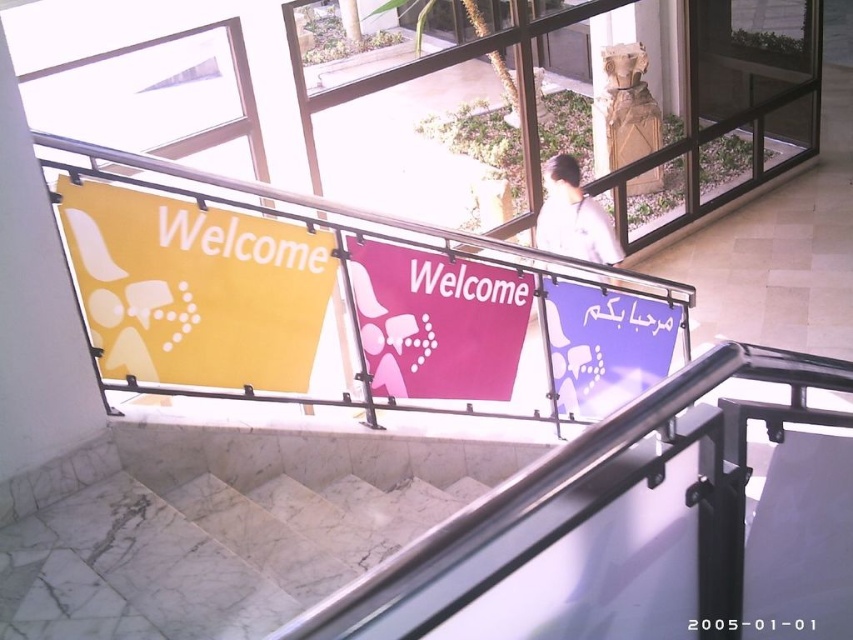
In the scene shown: Is yellow matte sign at left bigger than purple glossy sign at upper right?

Actually, yellow matte sign at left might be smaller than purple glossy sign at upper right.

Is yellow matte sign at left wider than purple glossy sign at upper right?

No, yellow matte sign at left is not wider than purple glossy sign at upper right.

Locate an element on the screen. The height and width of the screenshot is (640, 853). yellow matte sign at left is located at coordinates (195, 289).

Is pink fabric sign at center above purple glossy sign at upper right?

Yes, pink fabric sign at center is above purple glossy sign at upper right.

Can you confirm if pink fabric sign at center is positioned to the right of purple glossy sign at upper right?

Incorrect, pink fabric sign at center is not on the right side of purple glossy sign at upper right.

What do you see at coordinates (437, 321) in the screenshot?
I see `pink fabric sign at center` at bounding box center [437, 321].

At what (x,y) coordinates should I click in order to perform the action: click on pink fabric sign at center. Please return your answer as a coordinate pair (x, y). Looking at the image, I should click on (437, 321).

Which is above, yellow matte sign at left or pink fabric sign at center?

yellow matte sign at left

Between yellow matte sign at left and pink fabric sign at center, which one appears on the right side from the viewer's perspective?

Positioned to the right is pink fabric sign at center.

Is point (285, 355) less distant than point (474, 381)?

Yes, it is in front of point (474, 381).

The width and height of the screenshot is (853, 640). Find the location of `yellow matte sign at left`. yellow matte sign at left is located at coordinates (195, 289).